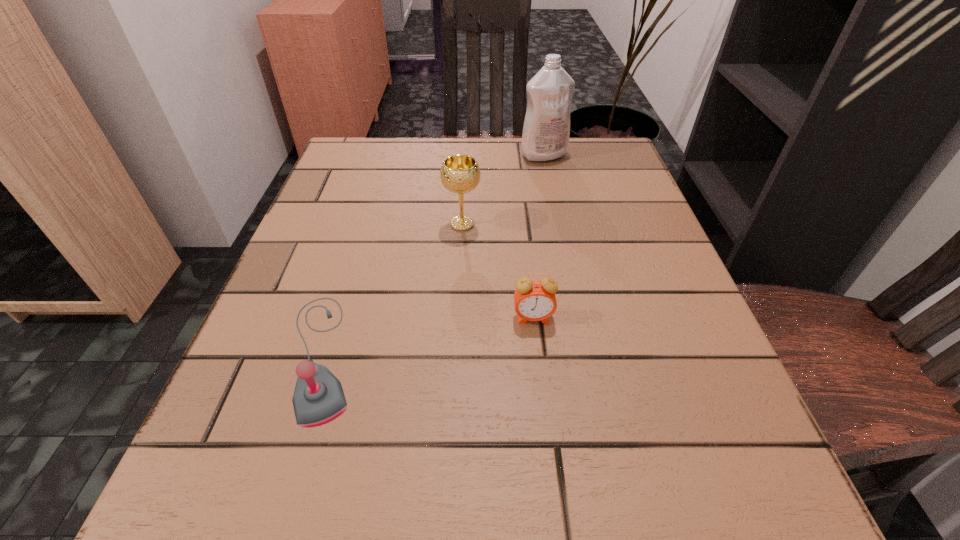
The width and height of the screenshot is (960, 540). Identify the location of the farthest object. [546, 130].

Identify the location of the tallest object. (546, 130).

You are a GUI agent. You are given a task and a screenshot of the screen. Output one action in this format:
    pyautogui.click(x=<x>, y=<y>)
    Task: Click on the third object from right to left
    The height and width of the screenshot is (540, 960).
    Given the screenshot: What is the action you would take?
    pyautogui.click(x=460, y=173)

Find the location of a particular element. Image resolution: width=960 pixels, height=540 pixels. chalice is located at coordinates (460, 173).

Image resolution: width=960 pixels, height=540 pixels. I want to click on alarm clock, so click(x=535, y=300).

Image resolution: width=960 pixels, height=540 pixels. I want to click on joystick, so 318,398.

Locate an element on the screen. This screenshot has width=960, height=540. free space located 0.300m on the front of the detergent is located at coordinates (563, 245).

The width and height of the screenshot is (960, 540). Identify the location of vacant point located on the left of the chalice. (383, 224).

Image resolution: width=960 pixels, height=540 pixels. What are the coordinates of `vacant space situated on the face of the alarm clock` in the screenshot? It's located at (544, 413).

Where is `vacant space located on the back of the leftmost object`? The height and width of the screenshot is (540, 960). vacant space located on the back of the leftmost object is located at coordinates (361, 231).